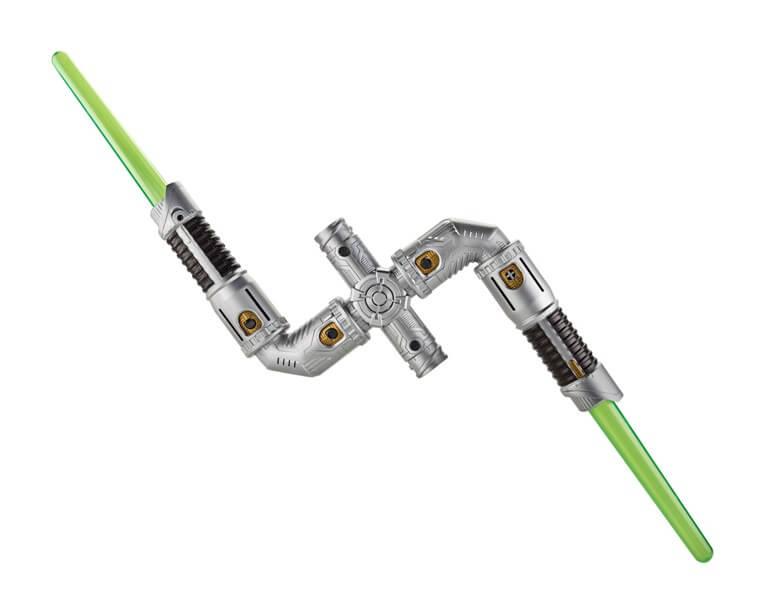
Identify the location of black screws. (411, 342), (342, 250), (332, 331), (251, 321), (427, 261).